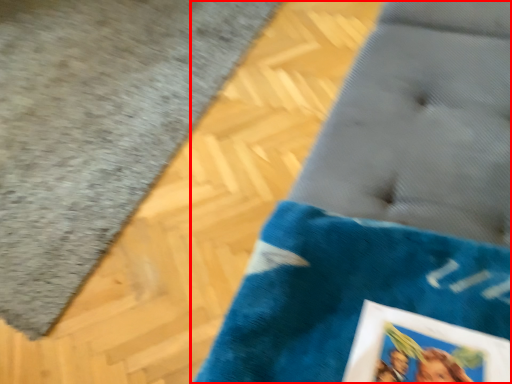
Question: Where is furniture (annotated by the red box) located in relation to bath mat in the image?

Choices:
 (A) left
 (B) right

Answer: (B)